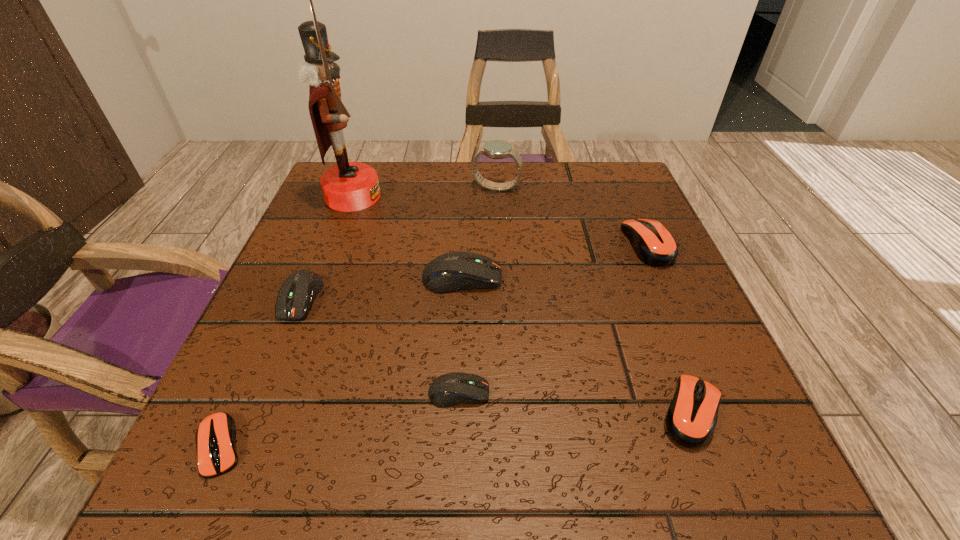
Where is `free region that satisfies the following two spatial constraints: 1. on the button of the second smallest orange computer mouse; 2. on the right side of the smallest dark computer equipment`? free region that satisfies the following two spatial constraints: 1. on the button of the second smallest orange computer mouse; 2. on the right side of the smallest dark computer equipment is located at coordinates (458, 411).

The height and width of the screenshot is (540, 960). I want to click on vacant space that satisfies the following two spatial constraints: 1. on the front-facing side of the tallest object; 2. on the right side of the farthest orange computer mouse, so click(335, 244).

Where is `vacant point that satisfies the following two spatial constraints: 1. on the front-facing side of the farthest orange computer mouse; 2. on the right side of the nutcracker`? vacant point that satisfies the following two spatial constraints: 1. on the front-facing side of the farthest orange computer mouse; 2. on the right side of the nutcracker is located at coordinates (335, 244).